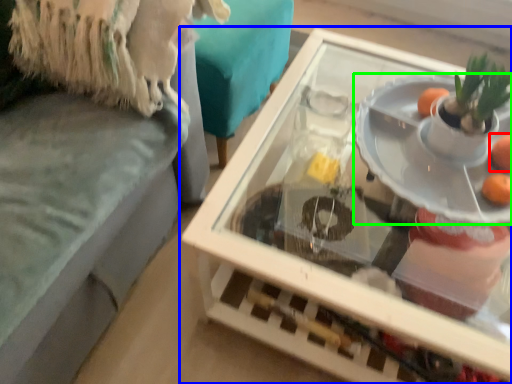
Question: Which is nearer to the orange (highlighted by a red box)? table (highlighted by a blue box) or plate (highlighted by a green box).

Choices:
 (A) table
 (B) plate

Answer: (B)